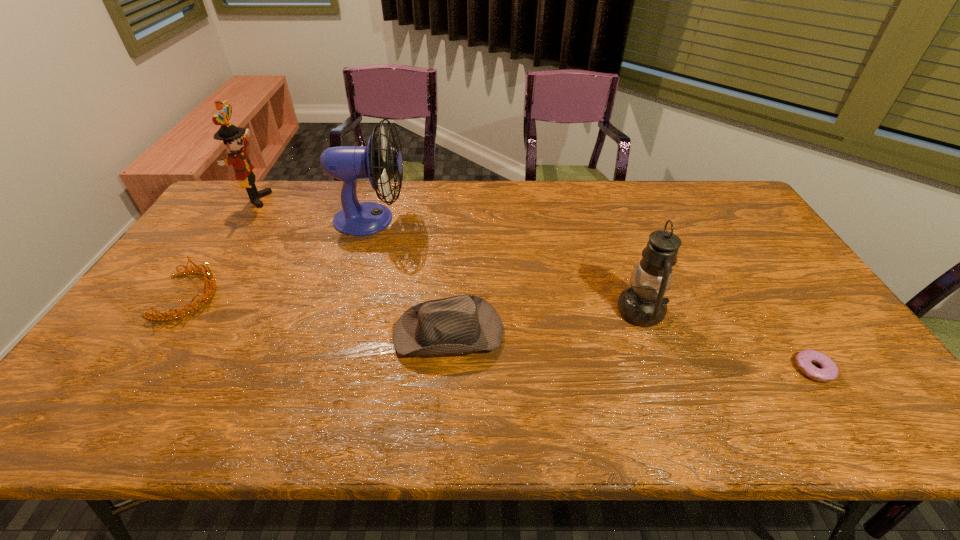
Where is `free space between the nutcracker and the oil lamp`? The height and width of the screenshot is (540, 960). free space between the nutcracker and the oil lamp is located at coordinates (448, 255).

Identify the location of free space between the nutcracker and the fan. (313, 209).

Locate an element on the screen. Image resolution: width=960 pixels, height=540 pixels. unoccupied position between the doughnut and the oil lamp is located at coordinates (728, 340).

The image size is (960, 540). What are the coordinates of `free spot between the fan and the nutcracker` in the screenshot? It's located at (313, 209).

This screenshot has height=540, width=960. In order to click on vacant area that lies between the shortest object and the third object from left to right in this screenshot , I will do `click(592, 294)`.

This screenshot has width=960, height=540. Identify the location of object that stands as the fourth closest to the fourth tallest object. (231, 135).

The image size is (960, 540). I want to click on object that can be found as the fourth closest to the oil lamp, so click(x=208, y=273).

Find the location of a particular element. The width and height of the screenshot is (960, 540). vacant space that satisfies the following two spatial constraints: 1. on the front side of the third shortest object; 2. on the left side of the doughnut is located at coordinates (446, 369).

Identify the location of free space that satisfies the following two spatial constraints: 1. in front of the doughnut where the airflow is directed; 2. on the left side of the fourth object from right to left. The height and width of the screenshot is (540, 960). (325, 369).

The height and width of the screenshot is (540, 960). I want to click on vacant point that satisfies the following two spatial constraints: 1. on the front-facing side of the doughnut; 2. on the left side of the nutcracker, so click(x=141, y=369).